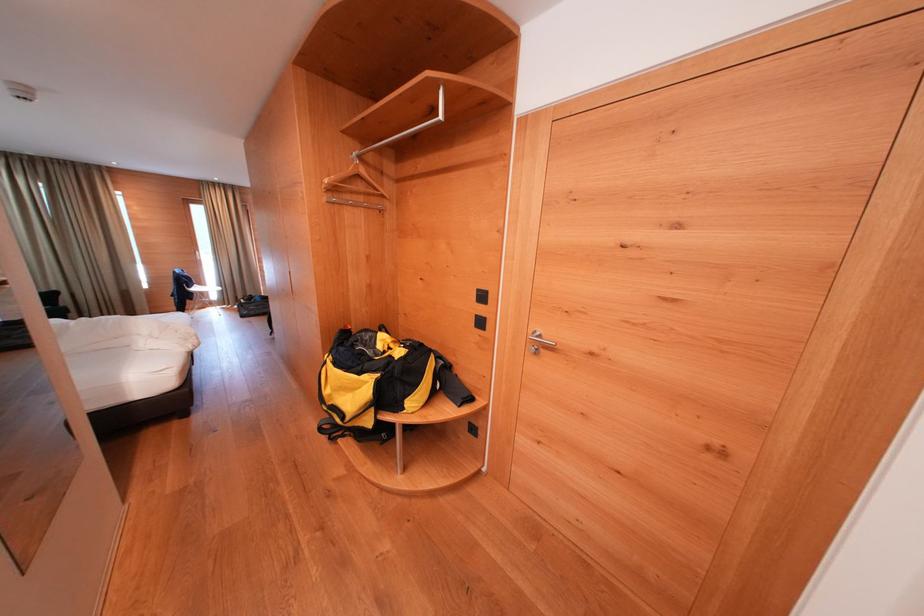
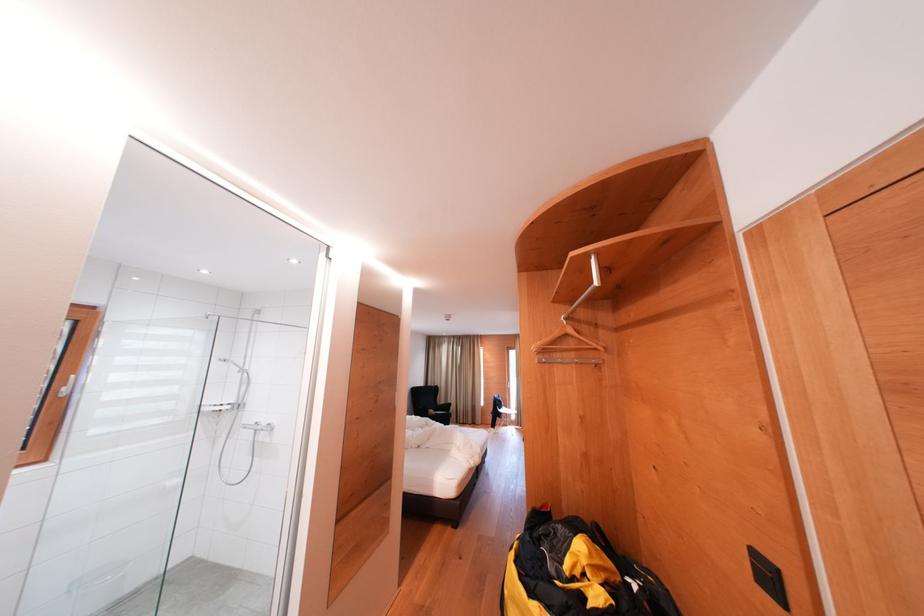
Locate, in the second image, the point that corresponds to point 369,203 in the first image.

(579, 359)